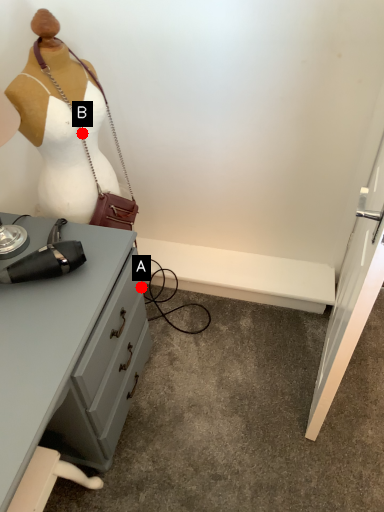
Question: Two points are circled on the image, labeled by A and B beside each circle. Which point is closer to the camera taking this photo?

Choices:
 (A) A is closer
 (B) B is closer

Answer: (B)